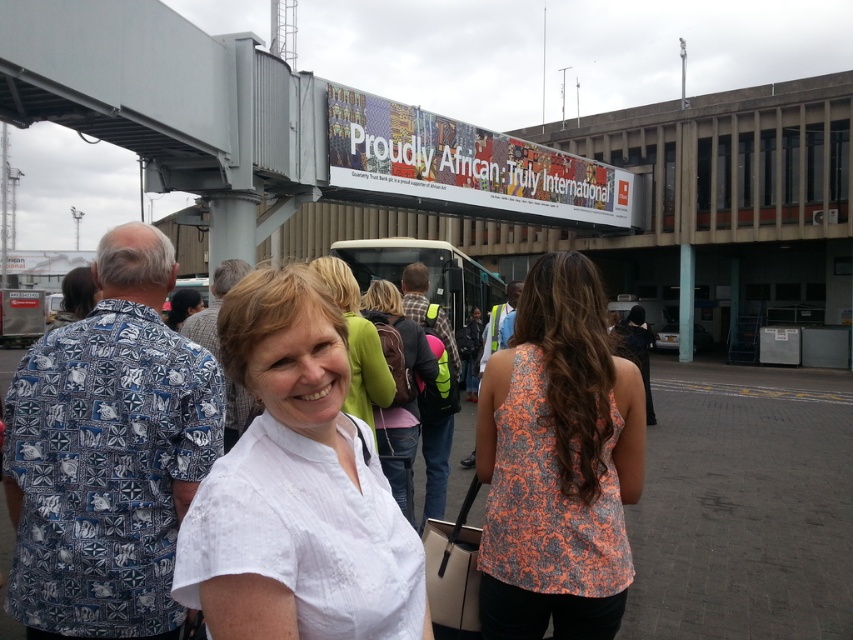
Question: Is green fabric backpack at center further to the viewer compared to white matte shirt at center?

Choices:
 (A) yes
 (B) no

Answer: (A)

Question: Which point is closer to the camera?

Choices:
 (A) orange-patterned fabric top at center
 (B) green fabric backpack at center
 (C) white cotton shirt at center
 (D) white plastic bus at center

Answer: (C)

Question: Is orange-patterned fabric top at center positioned behind white plastic bus at center?

Choices:
 (A) no
 (B) yes

Answer: (A)

Question: Is white plastic bus at center further to camera compared to green fabric backpack at center?

Choices:
 (A) no
 (B) yes

Answer: (B)

Question: Which object is closer to the camera taking this photo?

Choices:
 (A) green fabric backpack at center
 (B) orange-patterned fabric top at center
 (C) white matte shirt at center

Answer: (C)

Question: Which of the following is the farthest from the observer?

Choices:
 (A) (137, 112)
 (B) (288, 404)
 (C) (345, 397)
 (D) (451, 272)

Answer: (D)